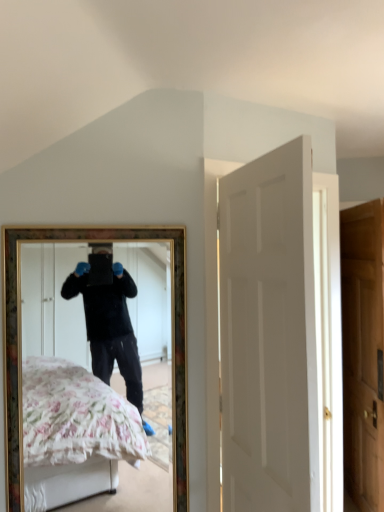
Question: Can you confirm if gold-framed mirror at center is taller than white matte door at center, which is the first door in left-to-right order?

Choices:
 (A) no
 (B) yes

Answer: (A)

Question: Considering the relative positions of gold-framed mirror at center and white matte door at center, which is the first door in left-to-right order, in the image provided, is gold-framed mirror at center to the left of white matte door at center, which is the first door in left-to-right order, from the viewer's perspective?

Choices:
 (A) no
 (B) yes

Answer: (B)

Question: Is gold-framed mirror at center not close to white matte door at center, the first door in the front-to-back sequence?

Choices:
 (A) no
 (B) yes

Answer: (B)

Question: Considering the relative sizes of gold-framed mirror at center and white matte door at center, which ranks as the 2th door in right-to-left order, in the image provided, is gold-framed mirror at center wider than white matte door at center, which ranks as the 2th door in right-to-left order,?

Choices:
 (A) no
 (B) yes

Answer: (A)

Question: Is gold-framed mirror at center completely or partially outside of white matte door at center, the first door in the front-to-back sequence?

Choices:
 (A) yes
 (B) no

Answer: (A)

Question: From a real-world perspective, is gold-framed mirror at center positioned above or below white matte door at center, which appears as the second door when viewed from the back?

Choices:
 (A) above
 (B) below

Answer: (B)

Question: Would you say gold-framed mirror at center is inside or outside white matte door at center, which ranks as the 2th door in right-to-left order?

Choices:
 (A) inside
 (B) outside

Answer: (B)

Question: In the image, is gold-framed mirror at center positioned in front of or behind white matte door at center, which appears as the second door when viewed from the back?

Choices:
 (A) front
 (B) behind

Answer: (B)

Question: In the image, is gold-framed mirror at center on the left side or the right side of white matte door at center, the first door in the front-to-back sequence?

Choices:
 (A) left
 (B) right

Answer: (A)

Question: Considering their positions, is gold-framed mirror at center located in front of or behind wooden door at right, marked as the second door in a left-to-right arrangement?

Choices:
 (A) front
 (B) behind

Answer: (A)

Question: Is gold-framed mirror at center wider or thinner than wooden door at right, placed as the 2th door when sorted from front to back?

Choices:
 (A) wide
 (B) thin

Answer: (B)

Question: Do you think gold-framed mirror at center is within wooden door at right, placed as the 2th door when sorted from front to back, or outside of it?

Choices:
 (A) outside
 (B) inside

Answer: (A)

Question: From the image's perspective, is gold-framed mirror at center located above or below wooden door at right, the first door from the back?

Choices:
 (A) below
 (B) above

Answer: (B)

Question: From the image's perspective, relative to gold-framed mirror at center, is wooden door at right, marked as the second door in a left-to-right arrangement, above or below?

Choices:
 (A) below
 (B) above

Answer: (A)

Question: Looking at the image, does wooden door at right, placed as the 2th door when sorted from front to back, seem bigger or smaller compared to gold-framed mirror at center?

Choices:
 (A) big
 (B) small

Answer: (A)